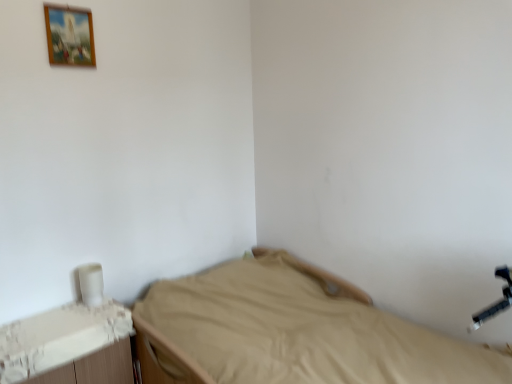
Describe the element at coordinates (293, 332) in the screenshot. This screenshot has height=384, width=512. I see `beige fabric bed at center` at that location.

Where is `wooden picture frame at upper left`? wooden picture frame at upper left is located at coordinates (69, 35).

Considering the relative positions of white plastic changing table at lower left and beige fabric bed at center in the image provided, is white plastic changing table at lower left to the left of beige fabric bed at center from the viewer's perspective?

Yes.

Consider the image. Considering the relative sizes of white plastic changing table at lower left and beige fabric bed at center in the image provided, is white plastic changing table at lower left bigger than beige fabric bed at center?

No.

Is white plastic changing table at lower left wider than beige fabric bed at center?

No.

Is white plastic changing table at lower left oriented away from beige fabric bed at center?

No, white plastic changing table at lower left's orientation is not away from beige fabric bed at center.

From the image's perspective, between wooden picture frame at upper left and white plastic changing table at lower left, who is located below?

white plastic changing table at lower left is shown below in the image.

Can you tell me how much wooden picture frame at upper left and white plastic changing table at lower left differ in facing direction?

They differ by 0.692 degrees in their facing directions.

Considering the sizes of objects wooden picture frame at upper left and white plastic changing table at lower left in the image provided, who is shorter, wooden picture frame at upper left or white plastic changing table at lower left?

With less height is wooden picture frame at upper left.

Choose the correct answer: Is wooden picture frame at upper left inside white plastic changing table at lower left or outside it?

wooden picture frame at upper left is located beyond the bounds of white plastic changing table at lower left.

Is beige fabric bed at center inside or outside of white plastic changing table at lower left?

beige fabric bed at center exists outside the volume of white plastic changing table at lower left.

From the image's perspective, is beige fabric bed at center positioned above or below white plastic changing table at lower left?

Result: beige fabric bed at center is above white plastic changing table at lower left.

Considering the relative sizes of beige fabric bed at center and white plastic changing table at lower left in the image provided, is beige fabric bed at center shorter than white plastic changing table at lower left?

No, beige fabric bed at center is not shorter than white plastic changing table at lower left.

Considering the sizes of objects beige fabric bed at center and white plastic changing table at lower left in the image provided, who is smaller, beige fabric bed at center or white plastic changing table at lower left?

Smaller between the two is white plastic changing table at lower left.

How many degrees apart are the facing directions of beige fabric bed at center and wooden picture frame at upper left?

They differ by 178 degrees in their facing directions.

Is point (276, 287) farther from viewer compared to point (70, 18)?

Yes, point (276, 287) is farther from viewer.

From the image's perspective, would you say beige fabric bed at center is positioned over wooden picture frame at upper left?

No, from the image's perspective, beige fabric bed at center is not over wooden picture frame at upper left.

Considering their positions, is beige fabric bed at center located in front of or behind wooden picture frame at upper left?

In the image, beige fabric bed at center appears in front of wooden picture frame at upper left.

You are a GUI agent. You are given a task and a screenshot of the screen. Output one action in this format:
    pyautogui.click(x=<x>, y=<y>)
    Task: Click on the changing table that is in front of the wooden picture frame at upper left
    Image resolution: width=512 pixels, height=384 pixels.
    Given the screenshot: What is the action you would take?
    pyautogui.click(x=59, y=337)

In terms of width, does white plastic changing table at lower left look wider or thinner when compared to wooden picture frame at upper left?

In the image, white plastic changing table at lower left appears to be wider than wooden picture frame at upper left.

In terms of size, does white plastic changing table at lower left appear bigger or smaller than wooden picture frame at upper left?

Clearly, white plastic changing table at lower left is larger in size than wooden picture frame at upper left.

Considering the positions of objects wooden picture frame at upper left and beige fabric bed at center in the image provided, who is more to the right, wooden picture frame at upper left or beige fabric bed at center?

beige fabric bed at center is more to the right.

Looking at their sizes, would you say wooden picture frame at upper left is wider or thinner than beige fabric bed at center?

In the image, wooden picture frame at upper left appears to be more narrow than beige fabric bed at center.

Is wooden picture frame at upper left facing away from beige fabric bed at center?

wooden picture frame at upper left is not turned away from beige fabric bed at center.

Find the location of `changing table behind the beige fabric bed at center`. changing table behind the beige fabric bed at center is located at coordinates (59, 337).

At what (x,y) coordinates should I click in order to perform the action: click on changing table below the wooden picture frame at upper left (from a real-world perspective). Please return your answer as a coordinate pair (x, y). The width and height of the screenshot is (512, 384). Looking at the image, I should click on (59, 337).

Which object lies further to the anchor point wooden picture frame at upper left, white plastic changing table at lower left or beige fabric bed at center?

beige fabric bed at center is positioned further to the anchor wooden picture frame at upper left.

Which object lies further to the anchor point beige fabric bed at center, white plastic changing table at lower left or wooden picture frame at upper left?

wooden picture frame at upper left lies further to beige fabric bed at center than the other object.

From the image, which object appears to be nearer to wooden picture frame at upper left, beige fabric bed at center or white plastic changing table at lower left?

white plastic changing table at lower left.

From the image, which object appears to be nearer to white plastic changing table at lower left, wooden picture frame at upper left or beige fabric bed at center?

beige fabric bed at center is closer to white plastic changing table at lower left.

Considering their positions, is wooden picture frame at upper left positioned closer to beige fabric bed at center than white plastic changing table at lower left?

white plastic changing table at lower left.

Estimate the real-world distances between objects in this image. Which object is closer to white plastic changing table at lower left, beige fabric bed at center or wooden picture frame at upper left?

beige fabric bed at center is closer to white plastic changing table at lower left.

The height and width of the screenshot is (384, 512). What are the coordinates of `bed between wooden picture frame at upper left and white plastic changing table at lower left in the vertical direction` in the screenshot? It's located at (293, 332).